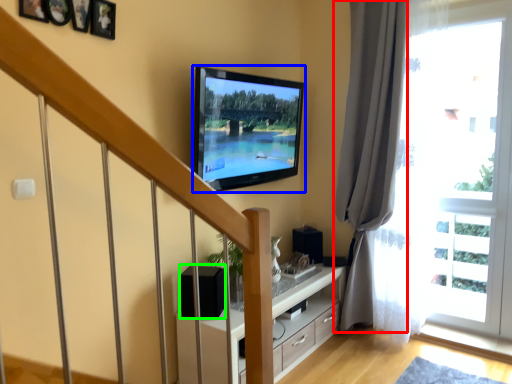
Question: Which object is positioned closest to curtain (highlighted by a red box)? Select from television (highlighted by a blue box) and speaker (highlighted by a green box).

Choices:
 (A) television
 (B) speaker

Answer: (A)